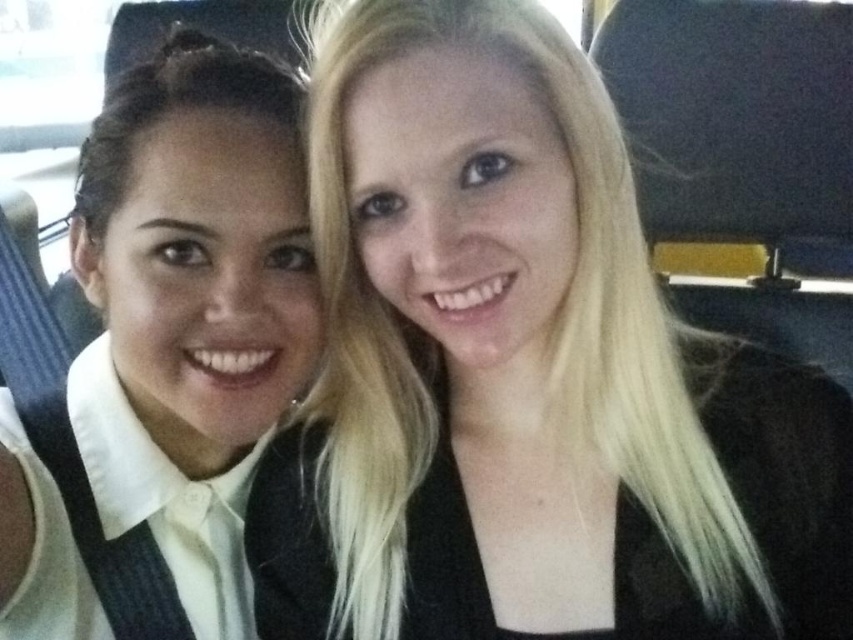
Which is in front, point (201, 273) or point (704, 144)?

Positioned in front is point (201, 273).

This screenshot has height=640, width=853. What do you see at coordinates (167, 355) in the screenshot?
I see `white matte shirt at left` at bounding box center [167, 355].

At what (x,y) coordinates should I click in order to perform the action: click on white matte shirt at left. Please return your answer as a coordinate pair (x, y). The height and width of the screenshot is (640, 853). Looking at the image, I should click on pos(167,355).

Is blonde hair at upper right below white matte shirt at left?

Indeed, blonde hair at upper right is positioned under white matte shirt at left.

Does blonde hair at upper right appear on the left side of white matte shirt at left?

In fact, blonde hair at upper right is to the right of white matte shirt at left.

Who is more distant from viewer, (344,323) or (143,262)?

Point (344,323)

The width and height of the screenshot is (853, 640). Find the location of `blonde hair at upper right`. blonde hair at upper right is located at coordinates (524, 374).

Is point (492, 172) closer to camera compared to point (682, 84)?

Yes, it is in front of point (682, 84).

Describe the element at coordinates (524, 374) in the screenshot. I see `blonde hair at upper right` at that location.

Is point (361, 504) more distant than point (730, 140)?

That is False.

What are the coordinates of `blonde hair at upper right` in the screenshot? It's located at (524, 374).